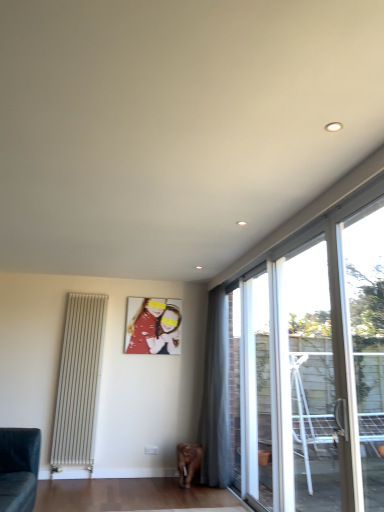
Question: Considering their positions, is transparent glass window at right, which ranks as the first window in back-to-front order, located in front of or behind transparent glass door at upper right, arranged as the 1th window when viewed from the front?

Choices:
 (A) front
 (B) behind

Answer: (B)

Question: Is transparent glass window at right, which ranks as the third window in front-to-back order, to the left or to the right of transparent glass door at upper right, arranged as the 1th window when viewed from the front, in the image?

Choices:
 (A) right
 (B) left

Answer: (B)

Question: Which object is positioned farthest from the transparent glass door at right, which is the 2th window from front to back?

Choices:
 (A) dark gray fabric couch at lower left
 (B) transparent glass door at upper right, the third window from the back
 (C) transparent glass window at right, which ranks as the third window in front-to-back order
 (D) gray sheer curtain at right
 (E) matte red photo frame at center

Answer: (A)

Question: Which object is positioned farthest from the matte red photo frame at center?

Choices:
 (A) transparent glass window at right, which ranks as the third window in front-to-back order
 (B) transparent glass door at upper right, arranged as the 1th window when viewed from the front
 (C) dark gray fabric couch at lower left
 (D) white metallic radiator at left
 (E) gray sheer curtain at right

Answer: (B)